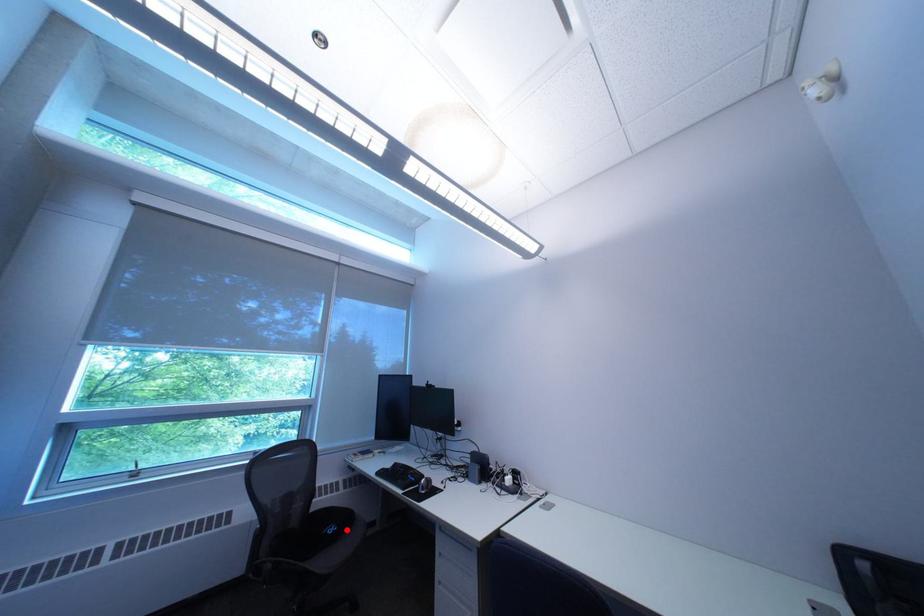
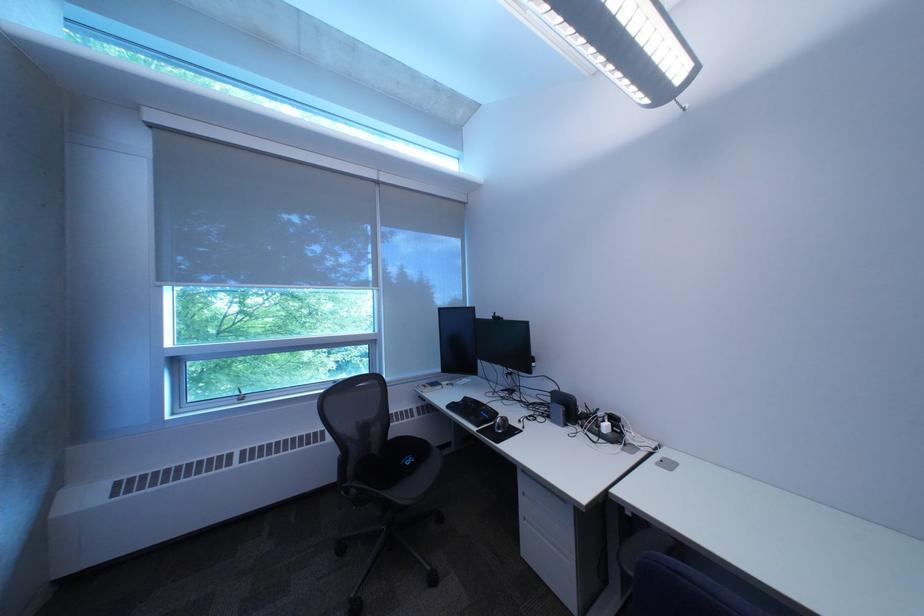
Where in the second image is the point corresponding to the highlighted location from the first image?

(423, 461)